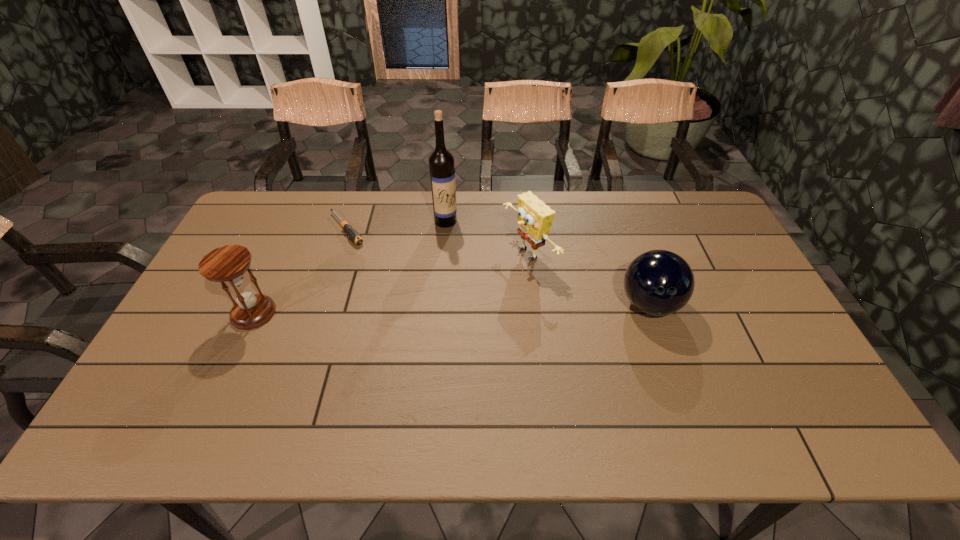
Locate an element on the screen. The height and width of the screenshot is (540, 960). the leftmost object is located at coordinates (227, 264).

Where is `the rightmost object`? This screenshot has height=540, width=960. the rightmost object is located at coordinates (658, 282).

Identify the location of wine bottle. The width and height of the screenshot is (960, 540). (441, 162).

The height and width of the screenshot is (540, 960). I want to click on the tallest object, so click(441, 162).

This screenshot has height=540, width=960. What are the coordinates of `the fourth object from right to left` in the screenshot? It's located at (352, 233).

You are a GUI agent. You are given a task and a screenshot of the screen. Output one action in this format:
    pyautogui.click(x=<x>, y=<y>)
    Task: Click on the screwdriver
    This screenshot has height=540, width=960.
    Given the screenshot: What is the action you would take?
    pyautogui.click(x=352, y=233)

Identify the location of the second object from right to left. The height and width of the screenshot is (540, 960). (535, 218).

This screenshot has width=960, height=540. What are the coordinates of `vacant region located on the right of the hourglass` in the screenshot? It's located at [325, 313].

This screenshot has width=960, height=540. In order to click on free location located 0.140m on the side of the rightmost object with the finger holes in this screenshot , I will do coord(674,374).

Where is `free region located 0.210m on the label of the third object from left to right`? free region located 0.210m on the label of the third object from left to right is located at coordinates (466, 269).